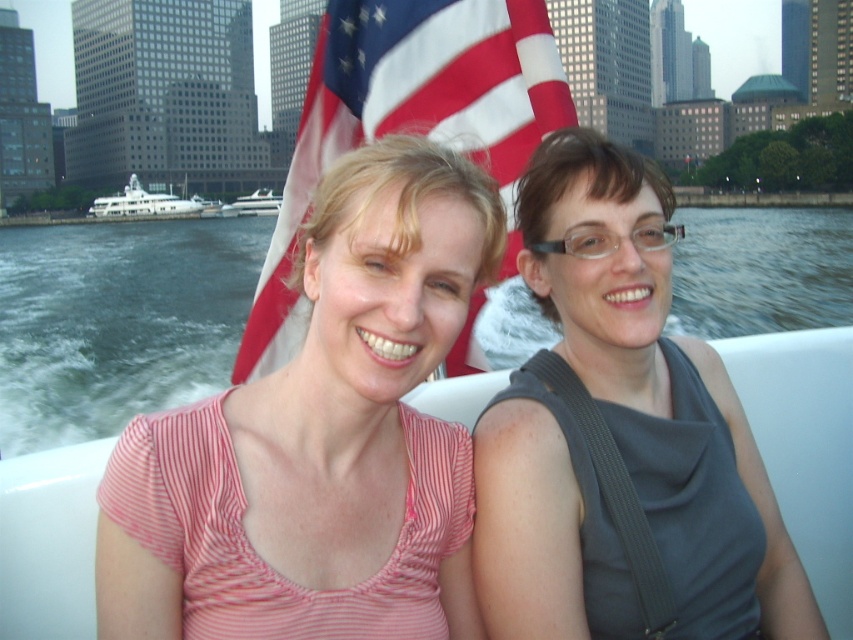
Question: Which point appears closest to the camera in this image?

Choices:
 (A) (490, 330)
 (B) (503, 129)
 (C) (672, 339)
 (D) (450, 428)

Answer: (D)

Question: Which point is closer to the camera?

Choices:
 (A) white glossy yacht at left
 (B) american flag at center

Answer: (B)

Question: Is white glossy yacht at left to the left of white glossy yacht at center from the viewer's perspective?

Choices:
 (A) no
 (B) yes

Answer: (B)

Question: Is matte gray tank top at center closer to the viewer compared to white glossy yacht at left?

Choices:
 (A) no
 (B) yes

Answer: (B)

Question: Where is matte gray tank top at center located in relation to american flag at center in the image?

Choices:
 (A) below
 (B) above

Answer: (A)

Question: Which point appears closest to the camera in this image?

Choices:
 (A) (138, 209)
 (B) (335, 628)
 (C) (599, 611)

Answer: (B)